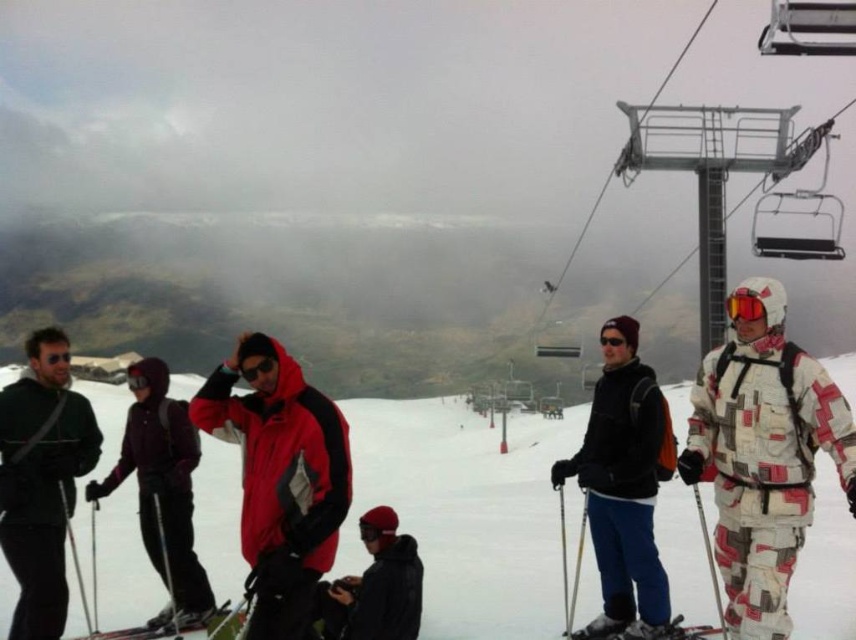
Question: Which is nearer to the matte red jacket at center?

Choices:
 (A) matte purple ski suit at left
 (B) white patchwork ski suit at right

Answer: (A)

Question: Which object appears closest to the camera in this image?

Choices:
 (A) white patchwork ski suit at right
 (B) matte purple ski suit at left

Answer: (A)

Question: Is matte black jacket at left below metallic gray chair at upper right?

Choices:
 (A) no
 (B) yes

Answer: (B)

Question: From the image, what is the correct spatial relationship of white patchwork ski suit at right in relation to matte red jacket at center?

Choices:
 (A) below
 (B) above

Answer: (B)

Question: From the image, what is the correct spatial relationship of black matte jacket at center in relation to metallic gray chair at upper right?

Choices:
 (A) below
 (B) above

Answer: (A)

Question: Which point appears farthest from the camera in this image?

Choices:
 (A) click(602, 515)
 (B) click(156, 616)
 (C) click(107, 637)

Answer: (B)